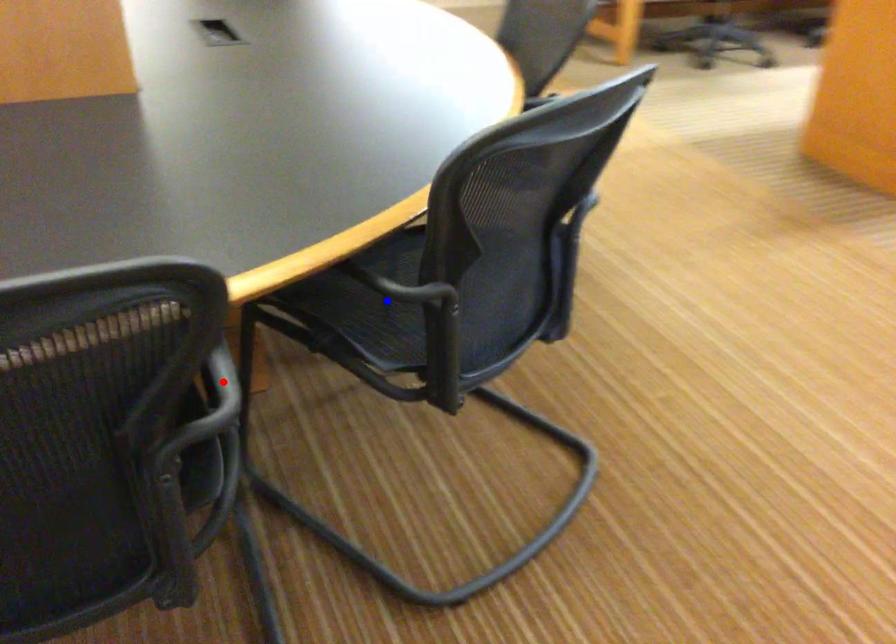
Question: Which of the two points in the image is closer to the camera?

Choices:
 (A) Blue point is closer.
 (B) Red point is closer.

Answer: (B)